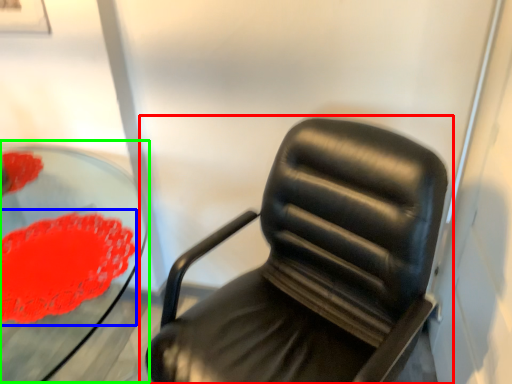
Question: Based on their relative distances, which object is farther from chair (highlighted by a red box)? Choose from flower (highlighted by a blue box) and round table (highlighted by a green box).

Choices:
 (A) flower
 (B) round table

Answer: (B)